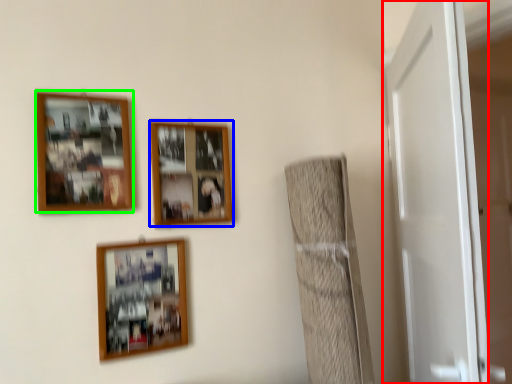
Question: Estimate the real-world distances between objects in this image. Which object is closer to door (highlighted by a red box), picture frame (highlighted by a blue box) or picture frame (highlighted by a green box)?

Choices:
 (A) picture frame
 (B) picture frame

Answer: (A)